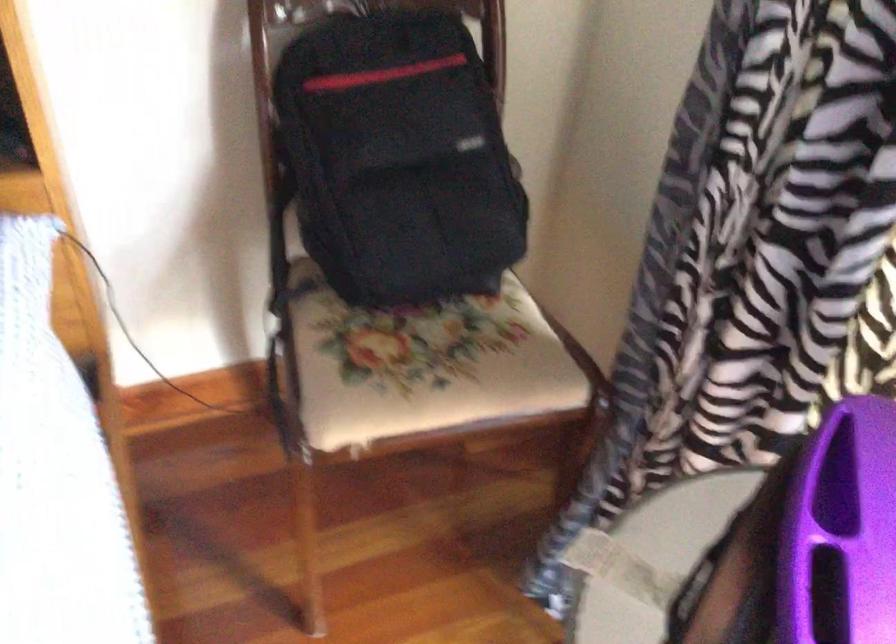
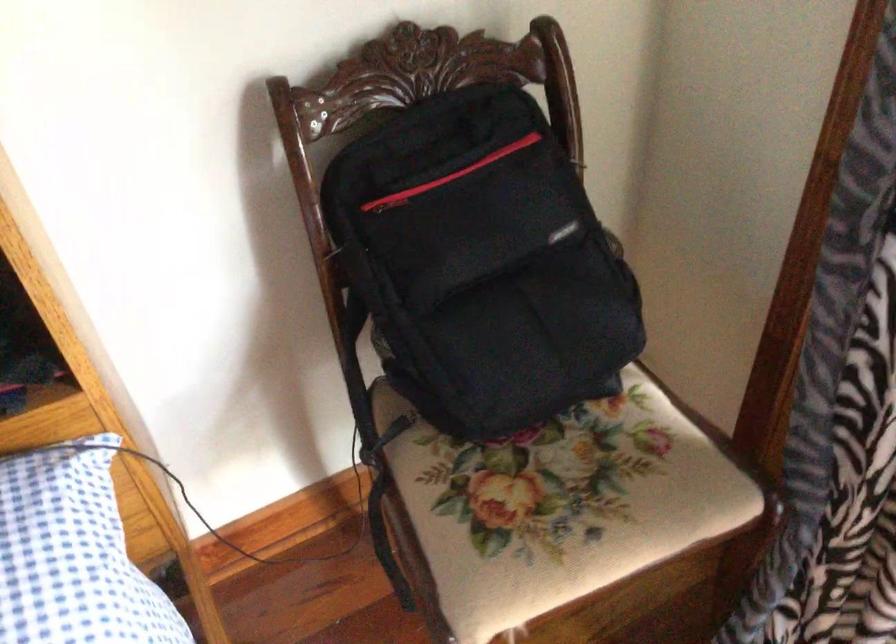
Find the pixel in the second image that matches [417,359] in the first image.

(556, 506)